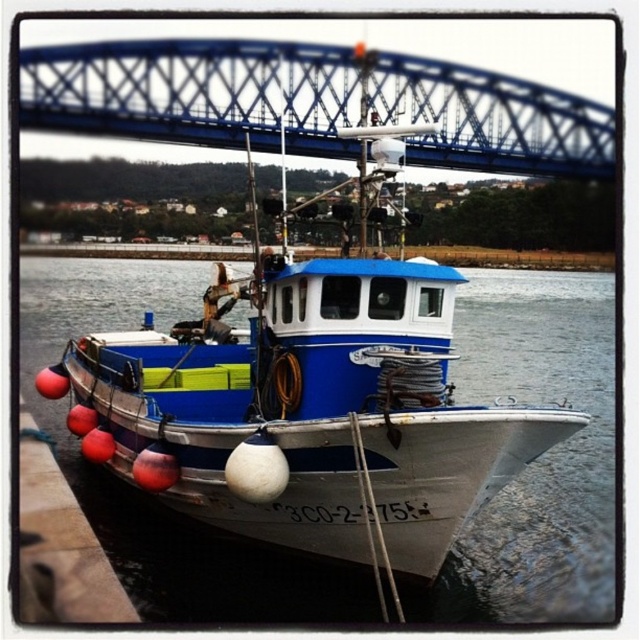
Question: Among these objects, which one is nearest to the camera?

Choices:
 (A) blue metallic bridge at upper center
 (B) white matte boat at center
 (C) smooth concrete dock at lower left

Answer: (C)

Question: Is blue metallic bridge at upper center wider than smooth concrete dock at lower left?

Choices:
 (A) no
 (B) yes

Answer: (B)

Question: Does white matte boat at center have a greater width compared to blue metallic bridge at upper center?

Choices:
 (A) yes
 (B) no

Answer: (B)

Question: Which object is farther from the camera taking this photo?

Choices:
 (A) smooth concrete dock at lower left
 (B) white matte boat at center
 (C) blue metallic bridge at upper center

Answer: (C)

Question: Which point is farther from the camera taking this photo?

Choices:
 (A) (33, 497)
 (B) (292, 284)

Answer: (A)

Question: Does white matte boat at center have a larger size compared to blue metallic bridge at upper center?

Choices:
 (A) yes
 (B) no

Answer: (A)